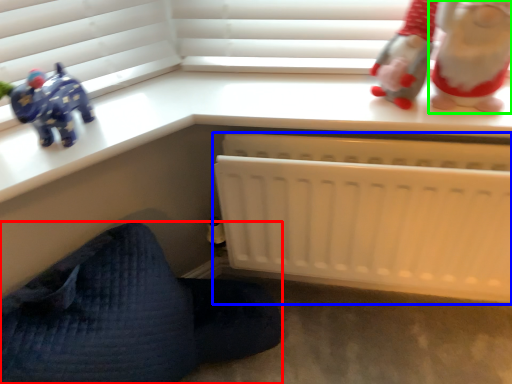
Question: Estimate the real-world distances between objects in this image. Which object is farther from furniture (highlighted by a red box), infant bed (highlighted by a blue box) or toy (highlighted by a green box)?

Choices:
 (A) infant bed
 (B) toy

Answer: (B)